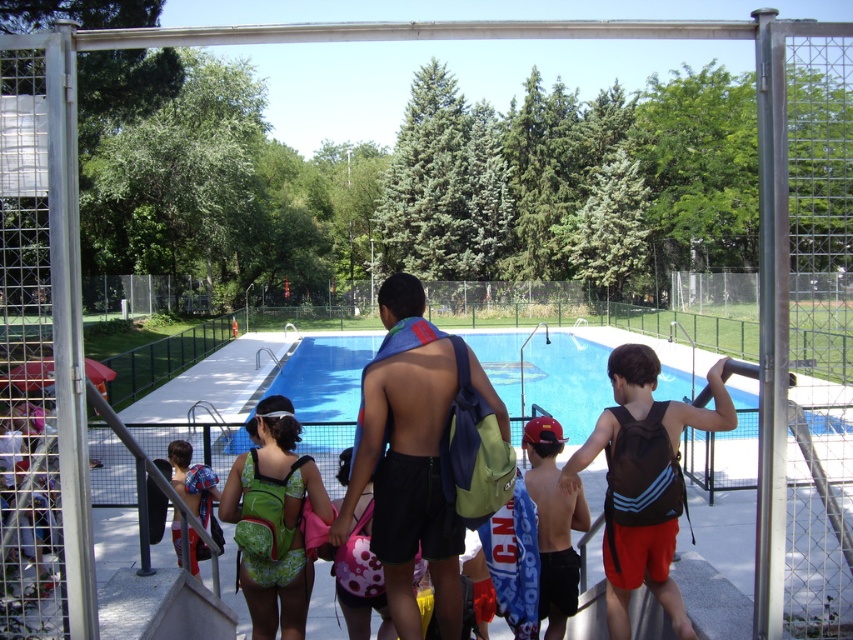
You are a lifeguard on duty and need to retrieve an item from the pool area. You see a black matte backpack at center and a red matte cap at center. Which item is closer to the pool edge?

The black matte backpack at center is shorter than the red matte cap at center, so the black matte backpack at center is closer to the pool edge.

You are standing at the point labeled as point (614,451) in the image. You want to retrieve a pool noodle that is placed exactly where you are standing. However, there is a 2.5 meters long safety rule that requires you to stay at least 2 meters away from the pool edge. Can you safely pick up the pool noodle without violating the safety rule?

The point labeled as point (614,451) is 3.45 meters away from the viewer. Since the safety rule requires staying at least 2 meters away from the pool edge, and the distance from the viewer to the point is 3.45 meters, you can safely pick up the pool noodle without violating the safety rule.